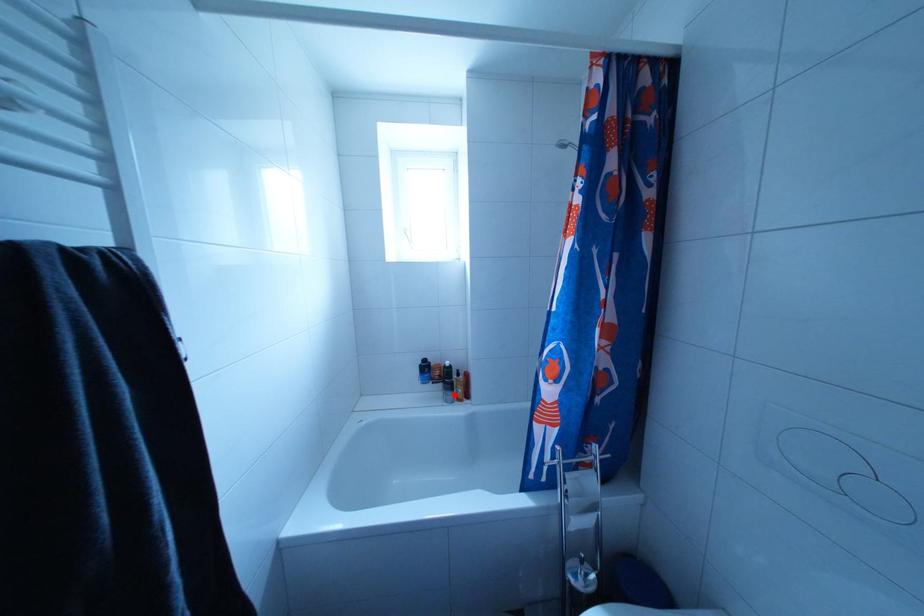
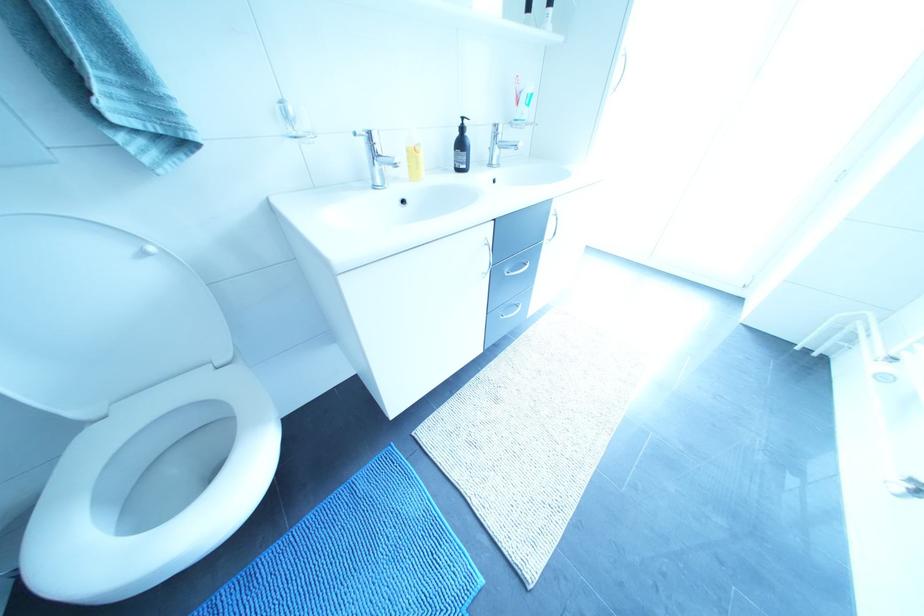
Question: I am providing you with two images of the same scene from different viewpoints. A red point is marked on the first image. Can you still see the location of the red point in image 2?

Choices:
 (A) Yes
 (B) No

Answer: (B)